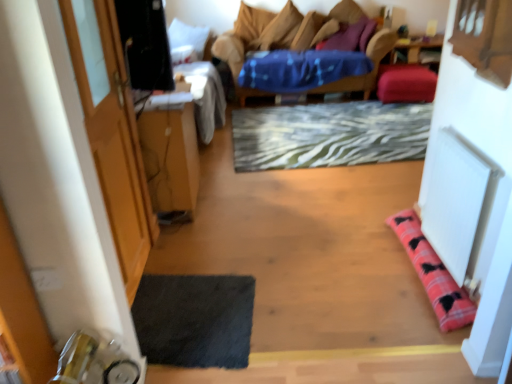
Locate an element on the screen. free space in front of wooden door at left is located at coordinates (168, 321).